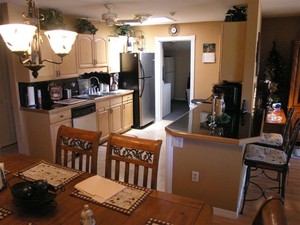
Where is `chairs`? The width and height of the screenshot is (300, 225). chairs is located at coordinates (150, 147), (92, 138), (275, 160), (272, 138).